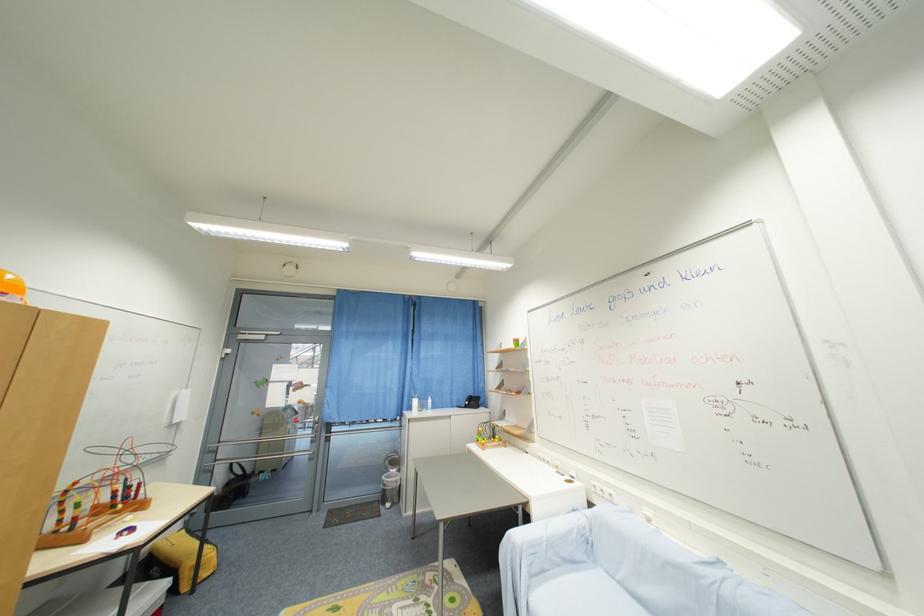
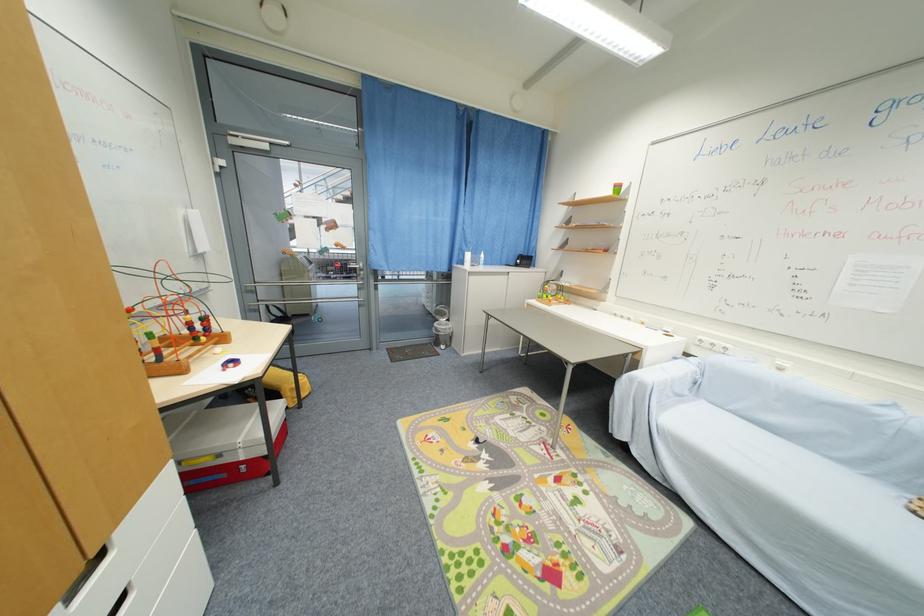
Where in the second image is the point corresponding to the point at 388,479 from the first image?

(441, 326)